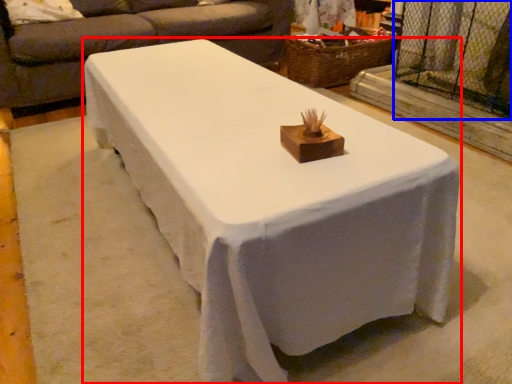
Question: Which object appears farthest to the camera in this image, table (highlighted by a red box) or screen door (highlighted by a blue box)?

Choices:
 (A) table
 (B) screen door

Answer: (B)